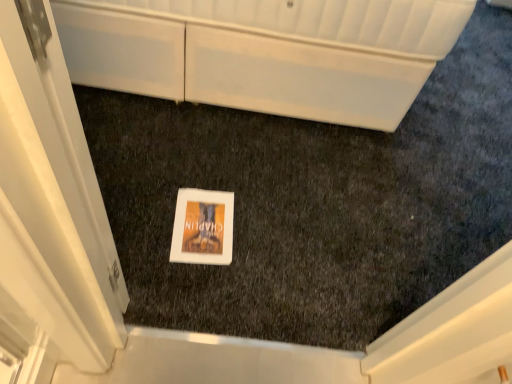
Question: Looking at the image, does white glossy door at center seem bigger or smaller compared to white glossy cabinet at upper center?

Choices:
 (A) big
 (B) small

Answer: (B)

Question: Relative to white glossy cabinet at upper center, is white glossy door at center in front or behind?

Choices:
 (A) front
 (B) behind

Answer: (A)

Question: Considering the positions of white glossy door at center and white glossy cabinet at upper center in the image, is white glossy door at center taller or shorter than white glossy cabinet at upper center?

Choices:
 (A) tall
 (B) short

Answer: (A)

Question: Considering the positions of white glossy cabinet at upper center and white glossy door at center in the image, is white glossy cabinet at upper center wider or thinner than white glossy door at center?

Choices:
 (A) wide
 (B) thin

Answer: (A)

Question: From the image's perspective, is white glossy cabinet at upper center located above or below white glossy door at center?

Choices:
 (A) above
 (B) below

Answer: (A)

Question: Visually, is white glossy cabinet at upper center positioned to the left or to the right of white glossy door at center?

Choices:
 (A) left
 (B) right

Answer: (B)

Question: From a real-world perspective, is white glossy cabinet at upper center physically located above or below white glossy door at center?

Choices:
 (A) above
 (B) below

Answer: (B)